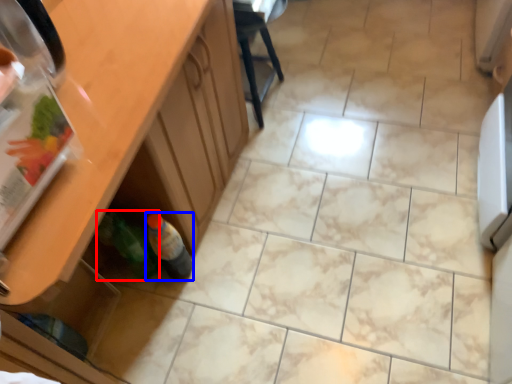
Question: Which of the following is the farthest to the observer, bottle (highlighted by a red box) or bottle (highlighted by a blue box)?

Choices:
 (A) bottle
 (B) bottle

Answer: (B)